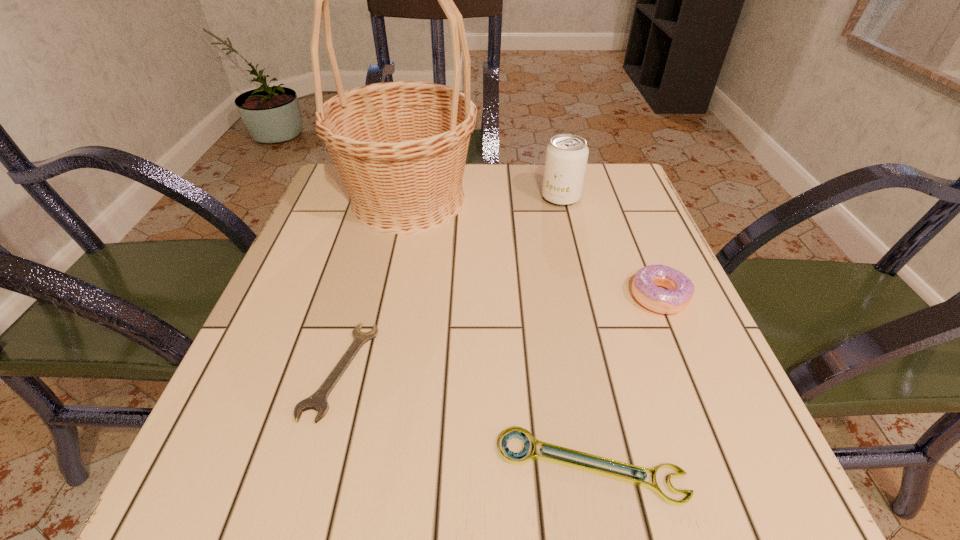
Identify the location of free space located 0.400m on the left of the doughnut. (419, 296).

Where is `free space located 0.390m on the left of the right wrench`? free space located 0.390m on the left of the right wrench is located at coordinates (210, 466).

Locate an element on the screen. The height and width of the screenshot is (540, 960). vacant space located on the right of the farther wrench is located at coordinates (514, 370).

In order to click on basket situated at the far edge in this screenshot , I will do `click(400, 147)`.

I want to click on soda can that is positioned at the far edge, so click(x=566, y=157).

At what (x,y) coordinates should I click in order to perform the action: click on object that is at the near edge. Please return your answer as a coordinate pair (x, y). Looking at the image, I should click on (513, 432).

Image resolution: width=960 pixels, height=540 pixels. Find the location of `basket positioned at the left edge`. basket positioned at the left edge is located at coordinates (400, 147).

This screenshot has height=540, width=960. What are the coordinates of `wrench positioned at the left edge` in the screenshot? It's located at (318, 401).

Locate an element on the screen. The image size is (960, 540). soda can that is at the right edge is located at coordinates (566, 157).

I want to click on doughnut positioned at the right edge, so [x=681, y=289].